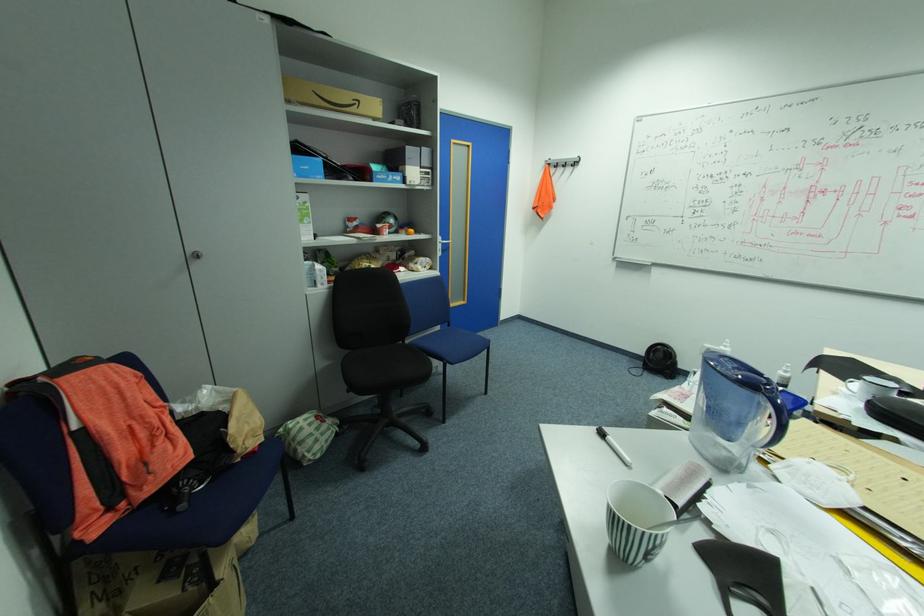
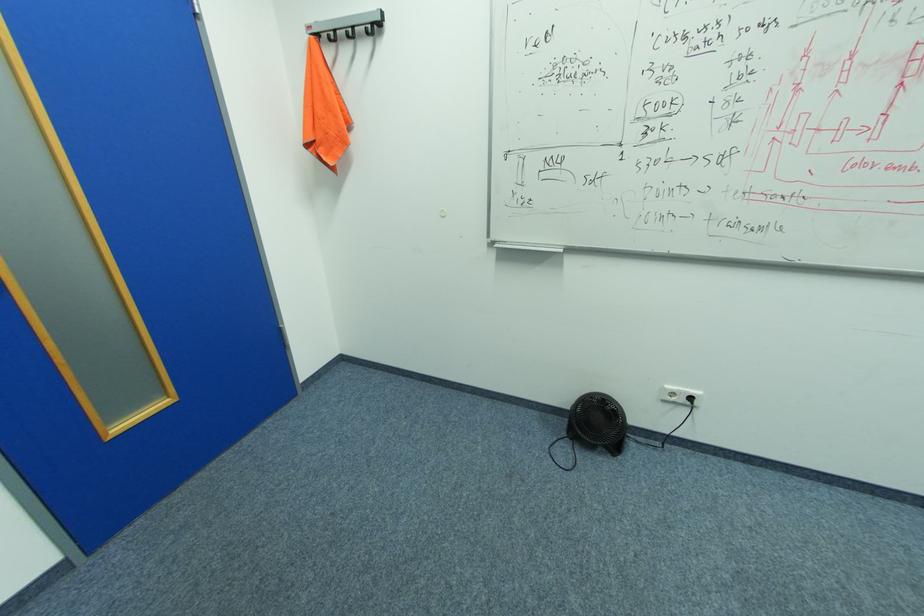
The point at (555, 164) is marked in the first image. Where is the corresponding point in the second image?

(324, 34)